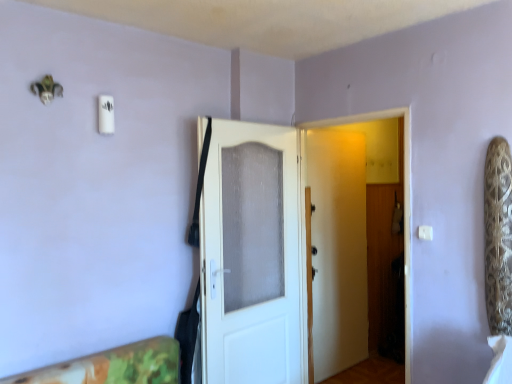
Measure the distance between point (426, 238) and camera.

A distance of 7.73 feet exists between point (426, 238) and camera.

Locate an element on the screen. The width and height of the screenshot is (512, 384). white textured door at center, which ranks as the second door in right-to-left order is located at coordinates (251, 257).

From a real-world perspective, is white textured door at center, which ranks as the second door in right-to-left order, positioned above or below white matte door at center, the 1th door when ordered from right to left?

In terms of real-world spatial position, white textured door at center, which ranks as the second door in right-to-left order, is above white matte door at center, the 1th door when ordered from right to left.

Visually, is white textured door at center, which ranks as the second door in right-to-left order, positioned to the left or to the right of white matte door at center, the 1th door when ordered from right to left?

white textured door at center, which ranks as the second door in right-to-left order, is positioned on white matte door at center, the 1th door when ordered from right to left,'s left side.

Between white textured door at center, arranged as the first door when viewed from the left, and white matte door at center, which appears as the second door when viewed from the left, which one has smaller size?

Smaller between the two is white textured door at center, arranged as the first door when viewed from the left.

In the scene shown: Considering the sizes of objects white textured door at center, which ranks as the second door in right-to-left order, and white matte door at center, which appears as the second door when viewed from the left, in the image provided, who is thinner, white textured door at center, which ranks as the second door in right-to-left order, or white matte door at center, which appears as the second door when viewed from the left,?

Thinner between the two is white textured door at center, which ranks as the second door in right-to-left order.

This screenshot has height=384, width=512. I want to click on light switch in front of the white textured door at center, which ranks as the second door in right-to-left order, so click(425, 232).

In terms of size, does white textured door at center, arranged as the first door when viewed from the left, appear bigger or smaller than white plastic light switch at upper right?

white textured door at center, arranged as the first door when viewed from the left, is bigger than white plastic light switch at upper right.

Considering the points (220, 347) and (420, 238), which point is behind, point (220, 347) or point (420, 238)?

The point (220, 347) is more distant.

Does white matte door at center, the 1th door when ordered from right to left, have a larger size compared to white textured door at center, which ranks as the second door in right-to-left order?

Yes, white matte door at center, the 1th door when ordered from right to left, is bigger than white textured door at center, which ranks as the second door in right-to-left order.

From the image's perspective, relative to white textured door at center, arranged as the first door when viewed from the left, is white matte door at center, which appears as the second door when viewed from the left, above or below?

Based on their image positions, white matte door at center, which appears as the second door when viewed from the left, is located above white textured door at center, arranged as the first door when viewed from the left.

Is the depth of white matte door at center, which appears as the second door when viewed from the left, less than that of white textured door at center, which ranks as the second door in right-to-left order?

Yes, white matte door at center, which appears as the second door when viewed from the left, is in front of white textured door at center, which ranks as the second door in right-to-left order.

Is white matte door at center, the 1th door when ordered from right to left, with white textured door at center, arranged as the first door when viewed from the left?

No.

Who is smaller, white matte door at center, the 1th door when ordered from right to left, or white plastic light switch at upper right?

white plastic light switch at upper right is smaller.

Is white matte door at center, the 1th door when ordered from right to left, situated inside white plastic light switch at upper right or outside?

white matte door at center, the 1th door when ordered from right to left, exists outside the volume of white plastic light switch at upper right.

Considering the relative sizes of white matte door at center, the 1th door when ordered from right to left, and white plastic light switch at upper right in the image provided, is white matte door at center, the 1th door when ordered from right to left, wider than white plastic light switch at upper right?

Correct, the width of white matte door at center, the 1th door when ordered from right to left, exceeds that of white plastic light switch at upper right.

Is white matte door at center, which appears as the second door when viewed from the left, taller than white plastic light switch at upper right?

Correct, white matte door at center, which appears as the second door when viewed from the left, is much taller as white plastic light switch at upper right.

Considering the sizes of objects white plastic light switch at upper right and white matte door at center, which appears as the second door when viewed from the left, in the image provided, who is taller, white plastic light switch at upper right or white matte door at center, which appears as the second door when viewed from the left,?

With more height is white matte door at center, which appears as the second door when viewed from the left.

Is white plastic light switch at upper right not near white matte door at center, which appears as the second door when viewed from the left?

No.

Is white plastic light switch at upper right facing away from white matte door at center, which appears as the second door when viewed from the left?

No, white matte door at center, which appears as the second door when viewed from the left, is not at the back of white plastic light switch at upper right.

From the image's perspective, does white plastic light switch at upper right appear lower than white matte door at center, which appears as the second door when viewed from the left?

No, from the image's perspective, white plastic light switch at upper right is not beneath white matte door at center, which appears as the second door when viewed from the left.

Consider the image. Is white plastic light switch at upper right facing towards white textured door at center, which ranks as the second door in right-to-left order?

No.

Consider the image. Is white plastic light switch at upper right situated inside white textured door at center, which ranks as the second door in right-to-left order, or outside?

white plastic light switch at upper right is spatially situated outside white textured door at center, which ranks as the second door in right-to-left order.

Is white plastic light switch at upper right far away from white textured door at center, arranged as the first door when viewed from the left?

white plastic light switch at upper right is positioned a significant distance from white textured door at center, arranged as the first door when viewed from the left.

The image size is (512, 384). In order to click on door that appears on the right of white textured door at center, arranged as the first door when viewed from the left in this screenshot , I will do coord(402,196).

From the white plastic light switch at upper right, count the 2nd door to the left and point to it. Please provide its 2D coordinates.

[(251, 257)]

Based on their spatial positions, is white matte door at center, which appears as the second door when viewed from the left, or white plastic light switch at upper right further from white textured door at center, which ranks as the second door in right-to-left order?

white plastic light switch at upper right is positioned further to the anchor white textured door at center, which ranks as the second door in right-to-left order.

Considering their positions, is white plastic light switch at upper right positioned further to white textured door at center, arranged as the first door when viewed from the left, than white matte door at center, the 1th door when ordered from right to left?

white plastic light switch at upper right is further to white textured door at center, arranged as the first door when viewed from the left.

From the image, which object appears to be nearer to white matte door at center, the 1th door when ordered from right to left, white textured door at center, arranged as the first door when viewed from the left, or white plastic light switch at upper right?

white textured door at center, arranged as the first door when viewed from the left.

Based on their spatial positions, is white matte door at center, which appears as the second door when viewed from the left, or white textured door at center, arranged as the first door when viewed from the left, further from white plastic light switch at upper right?

white textured door at center, arranged as the first door when viewed from the left, lies further to white plastic light switch at upper right than the other object.

Based on their spatial positions, is white plastic light switch at upper right or white textured door at center, which ranks as the second door in right-to-left order, closer to white matte door at center, the 1th door when ordered from right to left?

The object closer to white matte door at center, the 1th door when ordered from right to left, is white textured door at center, which ranks as the second door in right-to-left order.

From the image, which object appears to be nearer to white plastic light switch at upper right, white textured door at center, which ranks as the second door in right-to-left order, or white matte door at center, which appears as the second door when viewed from the left?

white matte door at center, which appears as the second door when viewed from the left, lies closer to white plastic light switch at upper right than the other object.

Find the location of `door situated between white textured door at center, arranged as the first door when viewed from the left, and white plastic light switch at upper right from left to right`. door situated between white textured door at center, arranged as the first door when viewed from the left, and white plastic light switch at upper right from left to right is located at coordinates (402, 196).